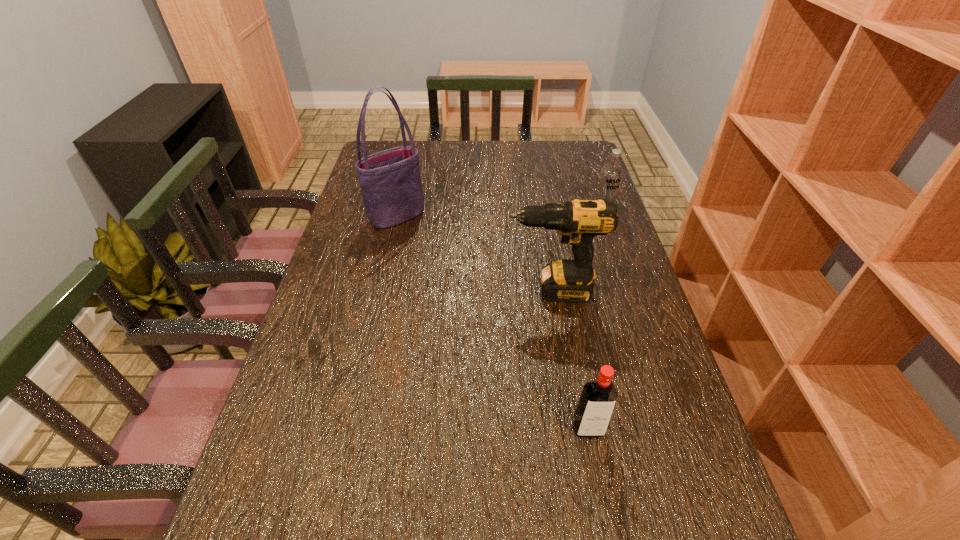
Where is `free region located at the tip of the second nearest object`? free region located at the tip of the second nearest object is located at coordinates (476, 291).

Find the location of `vacant space located 0.210m at the tip of the second nearest object`. vacant space located 0.210m at the tip of the second nearest object is located at coordinates pos(426,291).

The height and width of the screenshot is (540, 960). In order to click on vacant space located 0.190m on the front label of the right vodka in this screenshot , I will do `click(618, 259)`.

Identify the location of vacant point located 0.110m on the front and back of the nearer vodka. The height and width of the screenshot is (540, 960). (601, 498).

Image resolution: width=960 pixels, height=540 pixels. Identify the location of object at the left edge. (390, 180).

This screenshot has width=960, height=540. I want to click on drill that is at the right edge, so click(x=569, y=280).

Locate an element on the screen. This screenshot has width=960, height=540. vodka that is at the right edge is located at coordinates (611, 174).

Find the location of a particular element. The width and height of the screenshot is (960, 540). free space at the far edge of the desktop is located at coordinates (435, 144).

This screenshot has width=960, height=540. In order to click on free space at the left edge in this screenshot , I will do `click(366, 223)`.

Image resolution: width=960 pixels, height=540 pixels. In the image, there is a desktop. What are the coordinates of `vacant space at the right edge` in the screenshot? It's located at (619, 270).